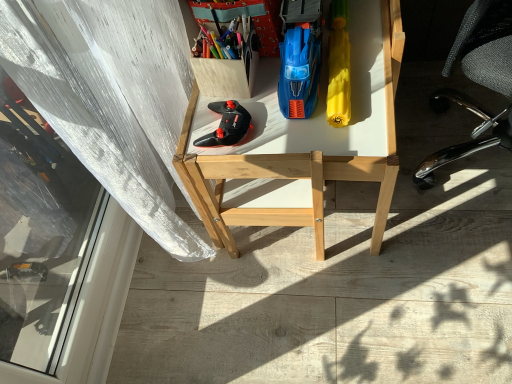
Question: Is black mesh office chair at right next to matte plastic container at upper center, marked as the fourth stationery in a right-to-left arrangement?

Choices:
 (A) yes
 (B) no

Answer: (B)

Question: From the image's perspective, does black mesh office chair at right appear lower than matte plastic container at upper center, marked as the fourth stationery in a right-to-left arrangement?

Choices:
 (A) no
 (B) yes

Answer: (B)

Question: Considering the relative positions of black mesh office chair at right and matte plastic container at upper center, marked as the fourth stationery in a right-to-left arrangement, in the image provided, is black mesh office chair at right in front of matte plastic container at upper center, marked as the fourth stationery in a right-to-left arrangement,?

Choices:
 (A) yes
 (B) no

Answer: (A)

Question: Is matte plastic container at upper center, positioned as the first stationery in left-to-right order, a part of black mesh office chair at right?

Choices:
 (A) yes
 (B) no

Answer: (B)

Question: Can you confirm if black mesh office chair at right is positioned to the right of matte plastic container at upper center, marked as the fourth stationery in a right-to-left arrangement?

Choices:
 (A) yes
 (B) no

Answer: (A)

Question: Would you say black mesh office chair at right is outside matte plastic container at upper center, positioned as the first stationery in left-to-right order?

Choices:
 (A) yes
 (B) no

Answer: (A)

Question: Can you confirm if wooden box at upper left, which appears as the third stationery when viewed from the right, is positioned to the left of black mesh office chair at right?

Choices:
 (A) yes
 (B) no

Answer: (A)

Question: From a real-world perspective, does wooden box at upper left, placed as the second stationery when sorted from left to right, sit lower than black mesh office chair at right?

Choices:
 (A) yes
 (B) no

Answer: (B)

Question: Does wooden box at upper left, which appears as the third stationery when viewed from the right, come behind black mesh office chair at right?

Choices:
 (A) yes
 (B) no

Answer: (A)

Question: Is wooden box at upper left, placed as the second stationery when sorted from left to right, closer to camera compared to black mesh office chair at right?

Choices:
 (A) yes
 (B) no

Answer: (B)

Question: Is wooden box at upper left, placed as the second stationery when sorted from left to right, aimed at black mesh office chair at right?

Choices:
 (A) no
 (B) yes

Answer: (B)

Question: Does wooden box at upper left, which appears as the third stationery when viewed from the right, have a lesser height compared to black mesh office chair at right?

Choices:
 (A) yes
 (B) no

Answer: (A)

Question: Could you tell me if wooden desk at center is turned towards black matte controller at center?

Choices:
 (A) no
 (B) yes

Answer: (A)